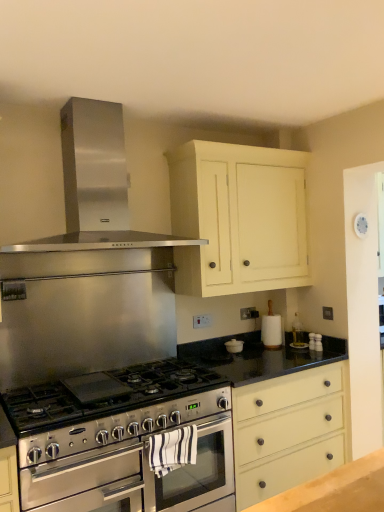
I want to click on empty space that is ontop of stainless steel exhaust hood at upper center (from a real-world perspective), so click(x=88, y=96).